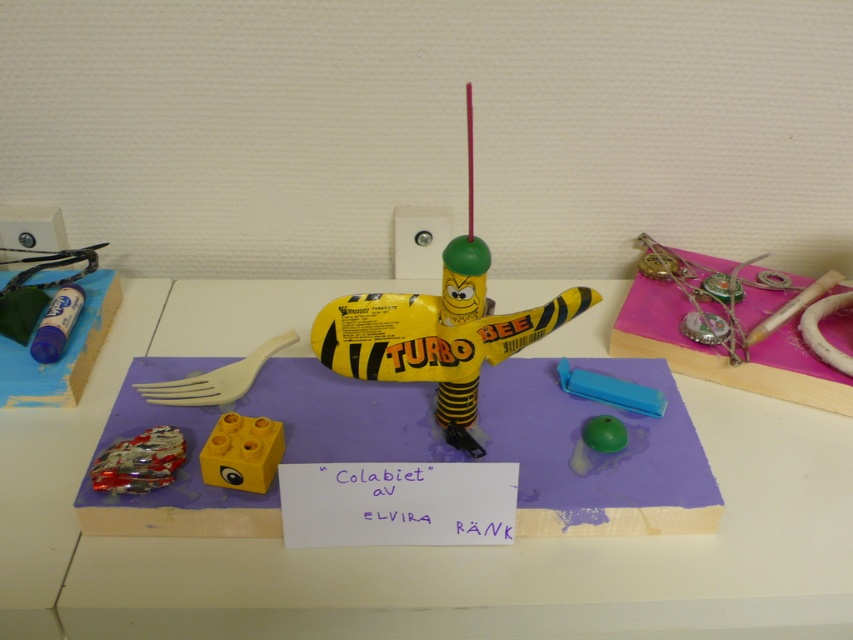
You are an artist working on a craft project. You need to place a purple foam board at center on your desk. Where should you place it?

You should place the purple foam board at center at point (419,545).